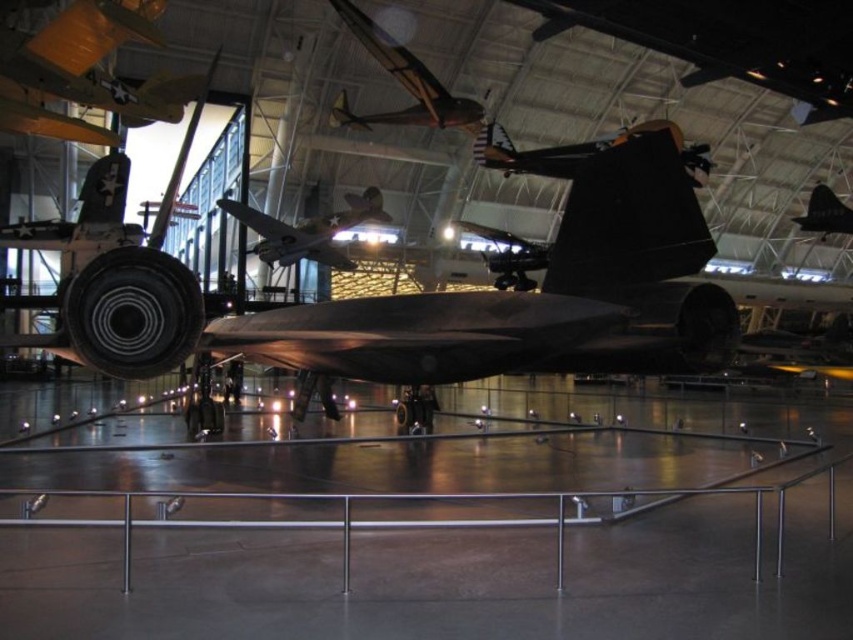
You are a visitor at the aviation museum and want to take a photo of the shiny silver airplane at center and the shiny black aircraft at center. Which one should you point your camera upwards to capture?

The shiny silver airplane at center is above the shiny black aircraft at center, so you should point your camera upwards to capture the shiny silver airplane at center.

You are a drone operator who needs to position your drone at the exact coordinates of the shiny metallic airplane at upper center. What are the coordinates you should input into your drone control system?

The coordinates for the shiny metallic airplane at upper center are at point (402, 83). Input these into your drone control system to position the drone there.

You are standing in the aviation museum and see two points marked on the floor. The first point is labeled as point (253, 246) and the second is labeled as point (836, 205). If you are facing the main jet aircraft, which point is closer to the back wall of the museum?

Point (253, 246) is behind point (836, 205), so it is closer to the back wall of the museum.